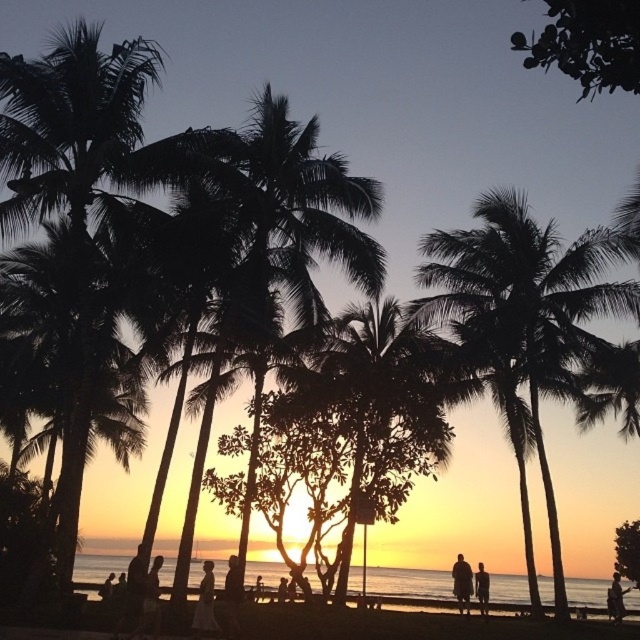
You are standing at the center of the beach facing the sunset. There is a point marked at coordinates point (524, 316). Which object does this point belong to?

The point (524, 316) is on the silhouette coconut palm at center.

You are standing at the center of the beach scene. Which direction should you walk to reach the silhouette leafy palm at left?

Since the silhouette leafy palm at left is located at coordinates point (72,200), you should walk to the left to reach it.